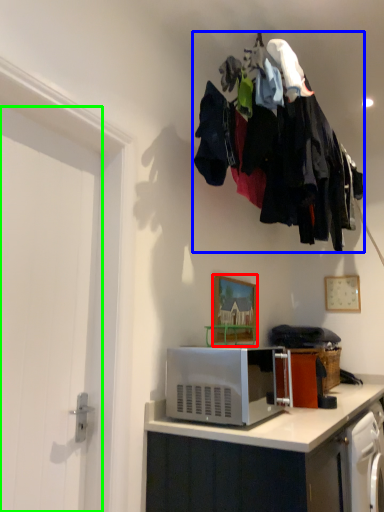
Question: Estimate the real-world distances between objects in this image. Which object is closer to picture frame (highlighted by a red box), laundry (highlighted by a blue box) or door (highlighted by a green box)?

Choices:
 (A) laundry
 (B) door

Answer: (A)